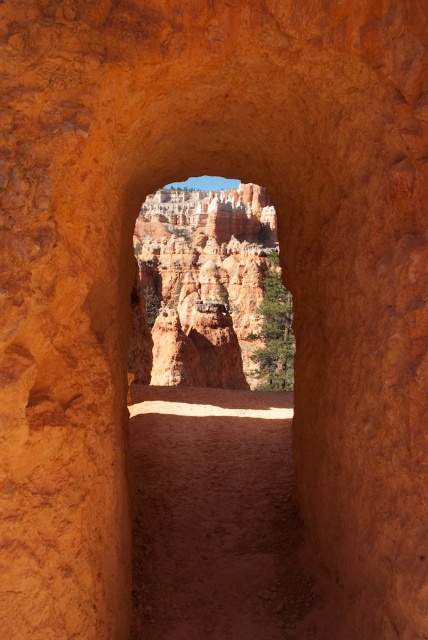
Question: Among these points, which one is farthest from the camera?

Choices:
 (A) (276, 604)
 (B) (151, 195)

Answer: (B)

Question: Which point appears closest to the camera in this image?

Choices:
 (A) pyautogui.click(x=261, y=337)
 (B) pyautogui.click(x=162, y=392)

Answer: (B)

Question: Is dusty reddish-brown dirt path at center further to the viewer compared to rustic sandstone hoodoo at center?

Choices:
 (A) no
 (B) yes

Answer: (A)

Question: Can you confirm if dusty reddish-brown dirt path at center is bigger than rustic sandstone hoodoo at center?

Choices:
 (A) no
 (B) yes

Answer: (A)

Question: Is dusty reddish-brown dirt path at center positioned before rustic sandstone hoodoo at center?

Choices:
 (A) yes
 (B) no

Answer: (A)

Question: Which object is closer to the camera taking this photo?

Choices:
 (A) dusty reddish-brown dirt path at center
 (B) rustic sandstone hoodoo at center

Answer: (A)